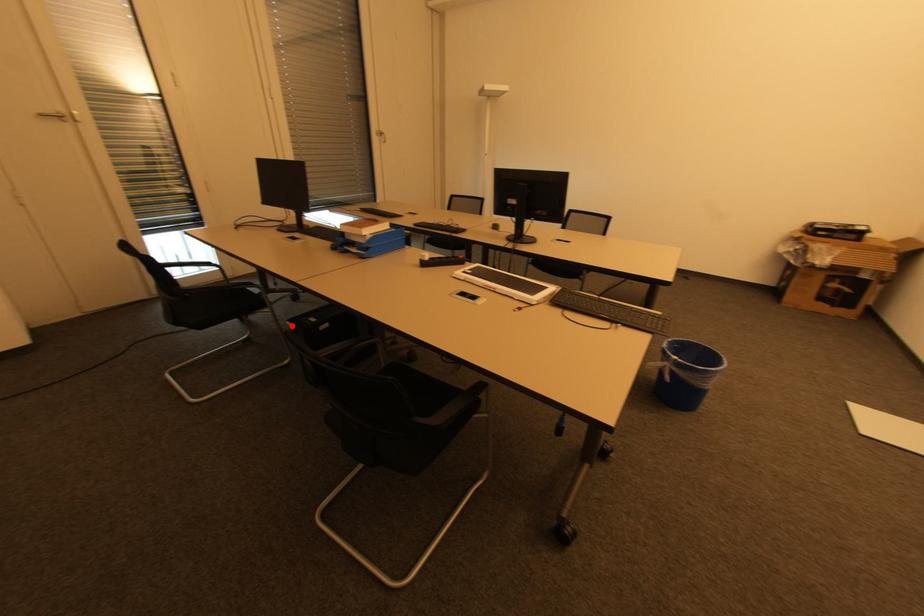
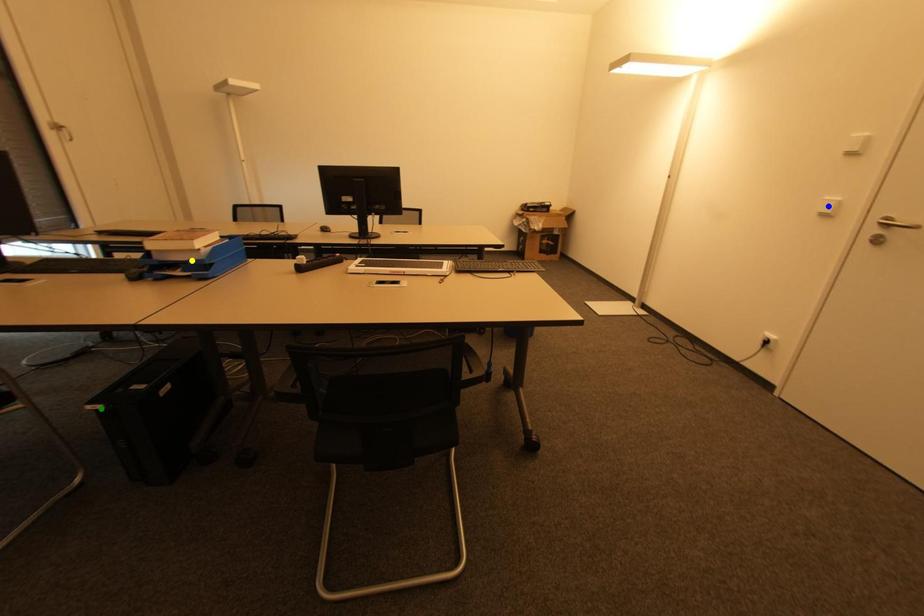
Question: I am providing you with two images of the same scene from different viewpoints. A red point is marked on the first image. You are given multiple points on the second image. Which mark in image 2 goes with the point in image 1?

Choices:
 (A) yellow point
 (B) green point
 (C) blue point

Answer: (B)